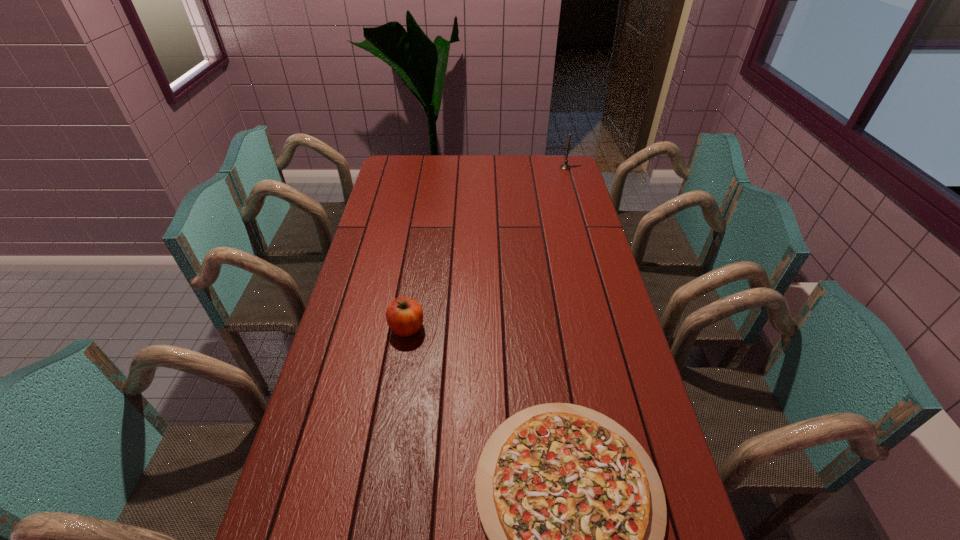
You are a GUI agent. You are given a task and a screenshot of the screen. Output one action in this format:
    pyautogui.click(x=<x>, y=<y>)
    Task: Click on the vacant space at the far edge
    The height and width of the screenshot is (540, 960).
    Given the screenshot: What is the action you would take?
    pos(539,180)

In the image, there is a desktop. Identify the location of free space at the left edge. This screenshot has height=540, width=960. (415, 184).

Where is `vacant space at the right edge of the desktop`? vacant space at the right edge of the desktop is located at coordinates (621, 316).

Find the location of a particular element. vacant space at the far left corner of the desktop is located at coordinates (402, 168).

Locate an element on the screen. The width and height of the screenshot is (960, 540). free space between the second farthest object and the tallest object is located at coordinates (486, 248).

This screenshot has height=540, width=960. Find the location of `object that is the closest to the shortest object`. object that is the closest to the shortest object is located at coordinates (404, 316).

Find the location of `object that stands as the closest to the farthest object`. object that stands as the closest to the farthest object is located at coordinates click(404, 316).

At what (x,y) coordinates should I click in order to perform the action: click on vacant space that satisfies the following two spatial constraints: 1. on the back side of the second shortest object; 2. on the left side of the farthest object. Please return your answer as a coordinate pair (x, y). Looking at the image, I should click on (432, 167).